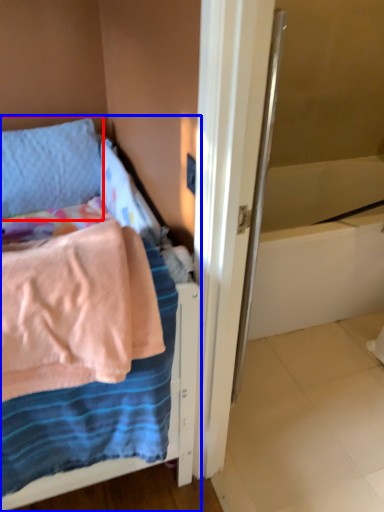
Question: Among these objects, which one is nearest to the camera, pillow (highlighted by a red box) or bed (highlighted by a blue box)?

Choices:
 (A) pillow
 (B) bed

Answer: (B)